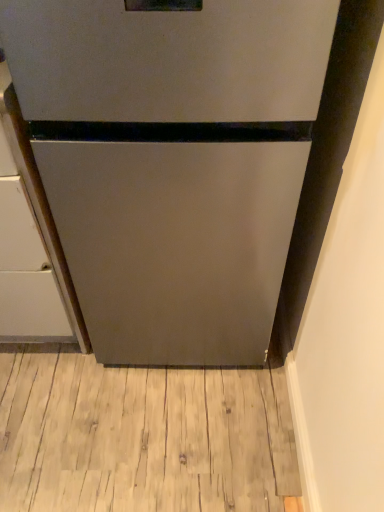
Question: Is satin silver refrigerator at center to the right of light brown wood flooring at lower center from the viewer's perspective?

Choices:
 (A) yes
 (B) no

Answer: (A)

Question: Is satin silver refrigerator at center shorter than light brown wood flooring at lower center?

Choices:
 (A) no
 (B) yes

Answer: (A)

Question: Are satin silver refrigerator at center and light brown wood flooring at lower center far apart?

Choices:
 (A) no
 (B) yes

Answer: (A)

Question: Can you confirm if satin silver refrigerator at center is thinner than light brown wood flooring at lower center?

Choices:
 (A) yes
 (B) no

Answer: (B)

Question: Is satin silver refrigerator at center further to the viewer compared to light brown wood flooring at lower center?

Choices:
 (A) no
 (B) yes

Answer: (A)

Question: Would you say satin silver refrigerator at center is to the left or to the right of satin silver cabinet at left in the picture?

Choices:
 (A) left
 (B) right

Answer: (B)

Question: Is satin silver refrigerator at center wider or thinner than satin silver cabinet at left?

Choices:
 (A) thin
 (B) wide

Answer: (A)

Question: From the image's perspective, relative to satin silver cabinet at left, is satin silver refrigerator at center above or below?

Choices:
 (A) below
 (B) above

Answer: (B)

Question: In terms of size, does satin silver refrigerator at center appear bigger or smaller than satin silver cabinet at left?

Choices:
 (A) small
 (B) big

Answer: (B)

Question: From a real-world perspective, is satin silver cabinet at left physically located above or below light brown wood flooring at lower center?

Choices:
 (A) below
 (B) above

Answer: (B)

Question: Which is correct: satin silver cabinet at left is inside light brown wood flooring at lower center, or outside of it?

Choices:
 (A) inside
 (B) outside

Answer: (B)

Question: Is point (31, 229) closer or farther from the camera than point (180, 433)?

Choices:
 (A) farther
 (B) closer

Answer: (B)

Question: Considering the relative positions of satin silver cabinet at left and light brown wood flooring at lower center in the image provided, is satin silver cabinet at left to the left or to the right of light brown wood flooring at lower center?

Choices:
 (A) left
 (B) right

Answer: (A)

Question: From the image's perspective, is light brown wood flooring at lower center positioned above or below satin silver refrigerator at center?

Choices:
 (A) above
 (B) below

Answer: (B)

Question: From their relative heights in the image, would you say light brown wood flooring at lower center is taller or shorter than satin silver refrigerator at center?

Choices:
 (A) tall
 (B) short

Answer: (B)